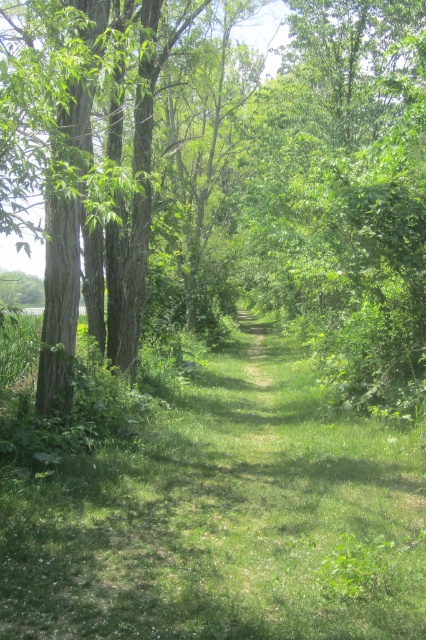
You are a hiker standing on the green grass at center and want to take a photo of the green leafy tree at center. Which object is closer to the camera to ensure the tree is in focus?

The green grass at center is closer to the camera than the green leafy tree at center. To ensure the tree is in focus, you should adjust the camera focus to the distance of the green leafy tree at center.

You are standing on the grassy pathway in the forest and see two points marked in the scene. Which point is closer to you, point (189, 288) or point (313, 627)?

Point (189, 288) is closer to you because it is further to the viewer than point (313, 627).

You are a hiker standing at the start of the grassy pathway. You want to take a photo of the green leafy tree at center from a distance of exactly 5 meters. Can you position yourself correctly to capture it at that distance?

The green leafy tree at center is 5.43 meters from camera, so you need to move 0.43 meters closer to the tree to achieve the desired 5 meter distance.